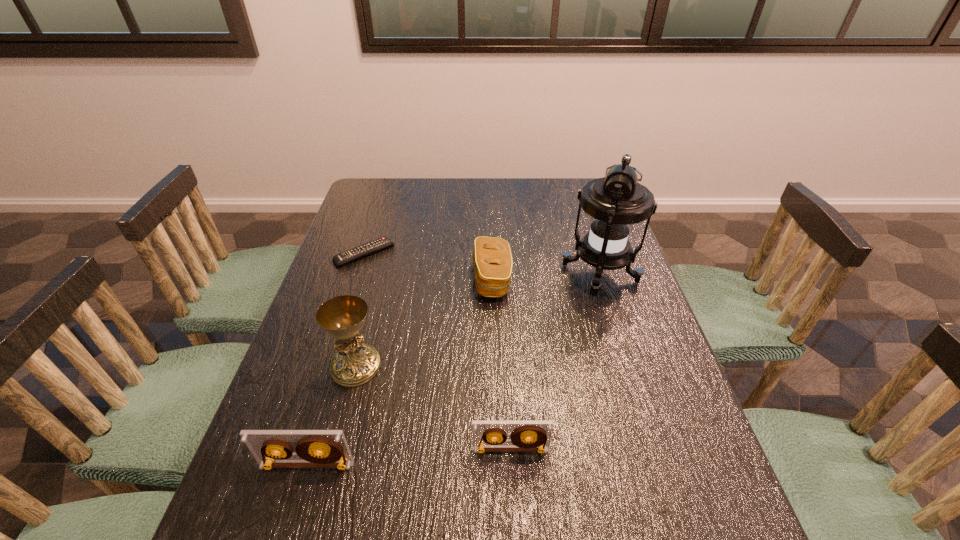
This screenshot has height=540, width=960. I want to click on empty space that is in between the rightmost object and the right videotape, so click(555, 362).

Identify the location of vacant point located between the fourth shortest object and the right videotape. (408, 457).

Locate an element on the screen. empty space between the clutch bag and the second nearest object is located at coordinates (501, 364).

Locate an element on the screen. This screenshot has width=960, height=540. vacant area that lies between the chalice and the shorter videotape is located at coordinates (433, 408).

Where is `free spot between the nearest object and the shorter videotape`? This screenshot has height=540, width=960. free spot between the nearest object and the shorter videotape is located at coordinates (408, 457).

Identify which object is located as the second nearest to the remote control. Please provide its 2D coordinates. Your answer should be formatted as a tuple, i.e. [(x, y)], where the tuple contains the x and y coordinates of a point satisfying the conditions above.

[(355, 363)]

Where is `the third closest object to the clutch bag`? The width and height of the screenshot is (960, 540). the third closest object to the clutch bag is located at coordinates (355, 363).

Where is `blank area in the image that satisfies the following two spatial constraints: 1. on the front side of the remote control; 2. on the right side of the lantern`? Image resolution: width=960 pixels, height=540 pixels. blank area in the image that satisfies the following two spatial constraints: 1. on the front side of the remote control; 2. on the right side of the lantern is located at coordinates [x=358, y=273].

Find the location of `vacant region that satisfies the following two spatial constraints: 1. on the back side of the tallest object; 2. on the left side of the chalice`. vacant region that satisfies the following two spatial constraints: 1. on the back side of the tallest object; 2. on the left side of the chalice is located at coordinates (380, 273).

You are a GUI agent. You are given a task and a screenshot of the screen. Output one action in this format:
    pyautogui.click(x=<x>, y=<y>)
    Task: Click on the vacant space that satisfies the following two spatial constraints: 1. on the front side of the third nearest object; 2. on the right side of the remote control
    The width and height of the screenshot is (960, 540).
    Given the screenshot: What is the action you would take?
    pyautogui.click(x=328, y=366)